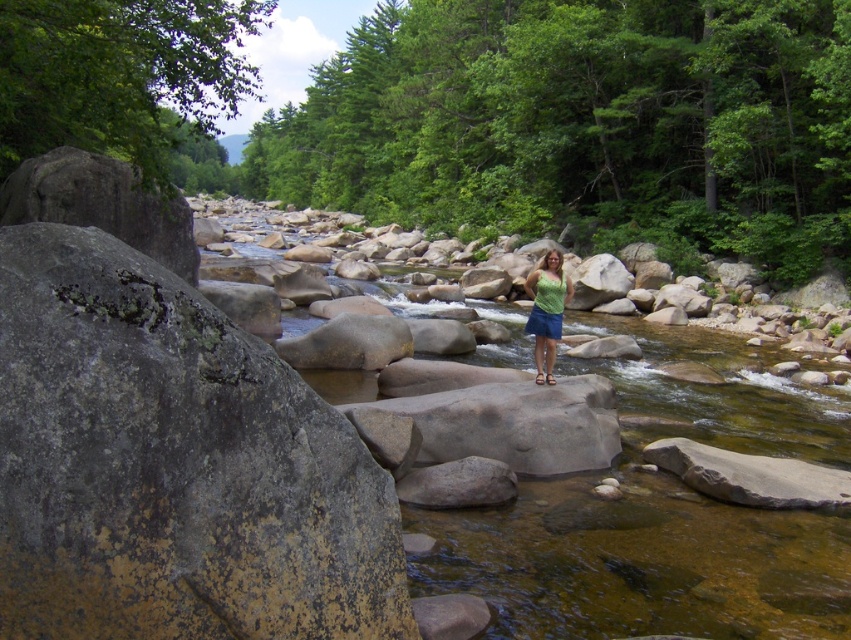
Question: Which object appears closest to the camera in this image?

Choices:
 (A) blue denim shorts at center
 (B) green matte tank top at center
 (C) clear water at center
 (D) grayish-brown textured rock at left

Answer: (D)

Question: Is grayish-brown textured rock at left further to camera compared to blue denim shorts at center?

Choices:
 (A) yes
 (B) no

Answer: (B)

Question: Which point appears farthest from the camera in this image?

Choices:
 (A) click(530, 330)
 (B) click(672, 326)

Answer: (B)

Question: Is grayish-brown textured rock at left positioned in front of green matte tank top at center?

Choices:
 (A) yes
 (B) no

Answer: (A)

Question: Among these points, which one is farthest from the camera?

Choices:
 (A) (100, 458)
 (B) (546, 278)
 (C) (541, 332)

Answer: (B)

Question: Is green matte tank top at center below blue denim shorts at center?

Choices:
 (A) yes
 (B) no

Answer: (B)